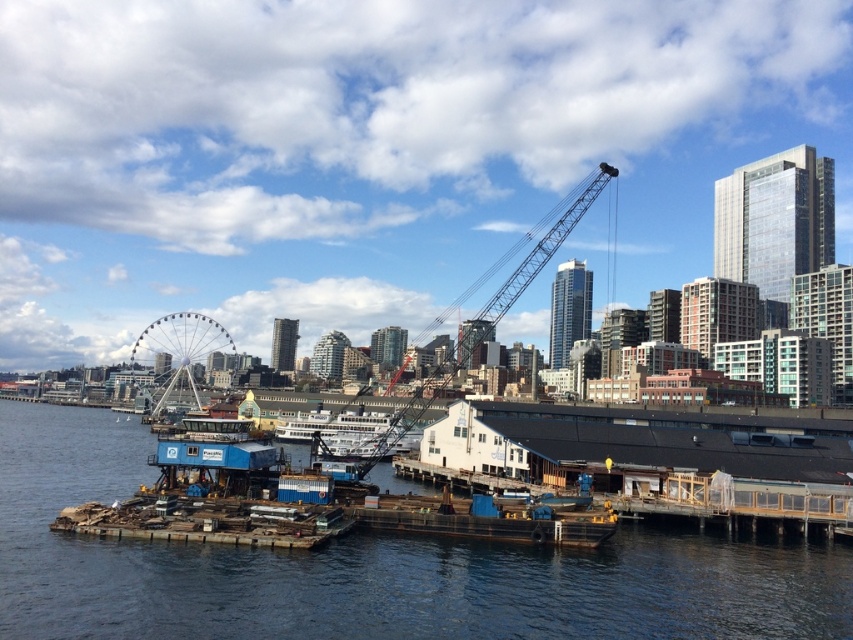
You are standing at the waterfront and want to determine which of the two points, point (642, 589) or point (566, 212), is nearer to you. Based on the scene, which point is closer?

Point (642, 589) is closer to the viewer than point (566, 212).

You are a construction worker standing at the edge of the brown wooden dock at center. You need to reach the industrial building located at coordinates point 0.889, 0.434. Can you directly walk from your current position to the industrial building without crossing any water?

The position of brown wooden dock at center is at point (369,568), so yes, you can directly walk from the brown wooden dock at center to the industrial building located at those coordinates without crossing any water because they are at the same position.